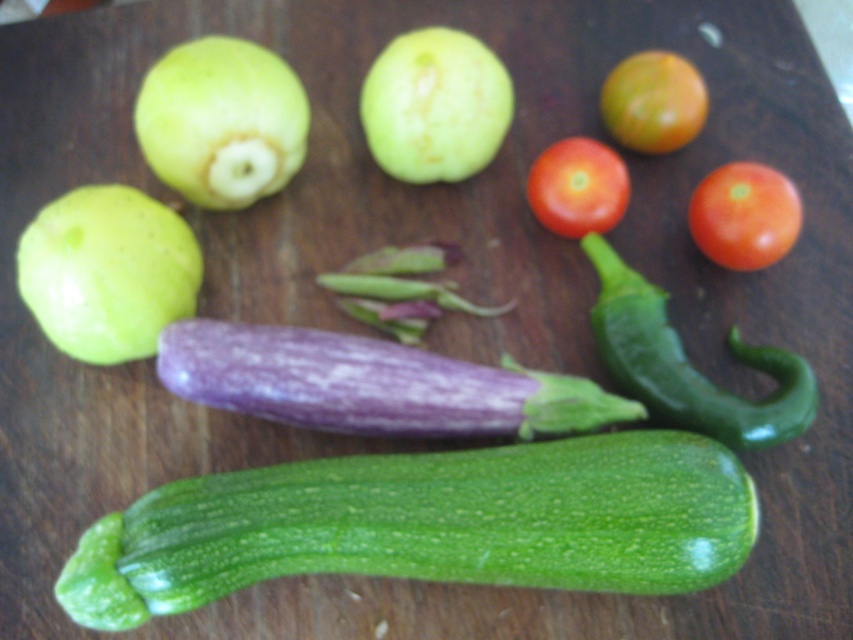
Question: Does green matte turnip at upper left appear over green glossy chili pepper at center right?

Choices:
 (A) yes
 (B) no

Answer: (A)

Question: Which object is positioned closest to the shiny red tomato at right?

Choices:
 (A) green matte apple at upper center
 (B) green matte zucchini at lower center
 (C) green matte turnip at upper left
 (D) red matte tomato at upper right

Answer: (D)

Question: Is green matte apple at left bigger than green matte turnip at upper left?

Choices:
 (A) yes
 (B) no

Answer: (A)

Question: Does green matte apple at left come behind green matte apple at upper center?

Choices:
 (A) no
 (B) yes

Answer: (A)

Question: Based on their relative distances, which object is farther from the shiny red tomato at upper right?

Choices:
 (A) green matte turnip at upper left
 (B) green matte apple at left
 (C) purple matte eggplant at center
 (D) shiny red tomato at right

Answer: (B)

Question: Which of the following is the closest to the observer?

Choices:
 (A) (302, 330)
 (B) (648, 77)
 (C) (631, 269)

Answer: (A)